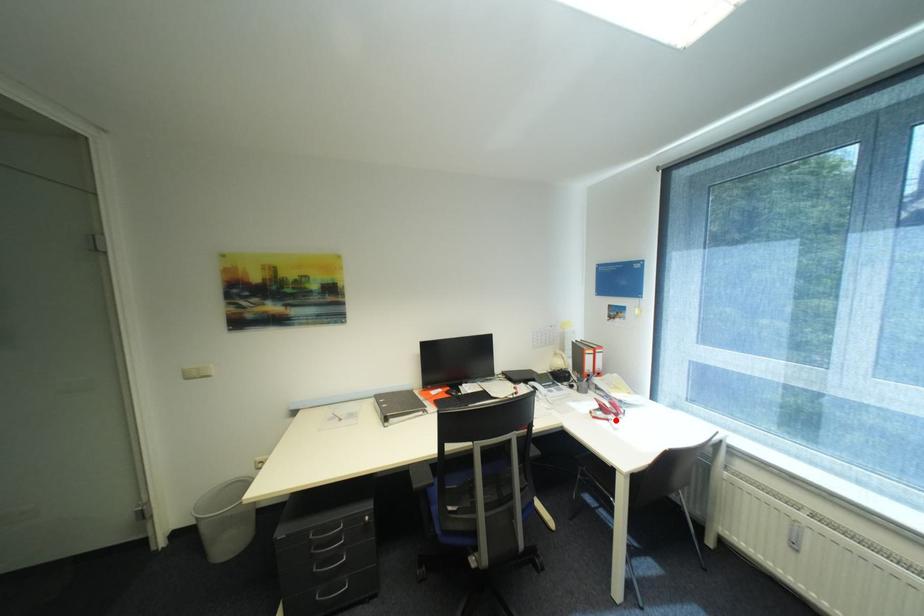
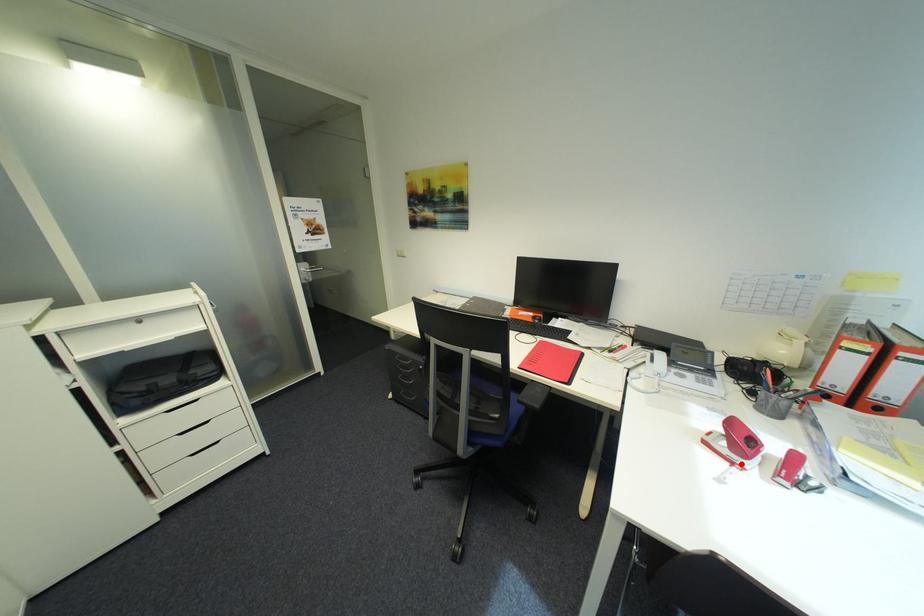
I am providing you with two images of the same scene from different viewpoints. A red point is marked on the first image and another point is marked on the second image. Is the red point in image1 aligned with the point shown in image2?

Yes